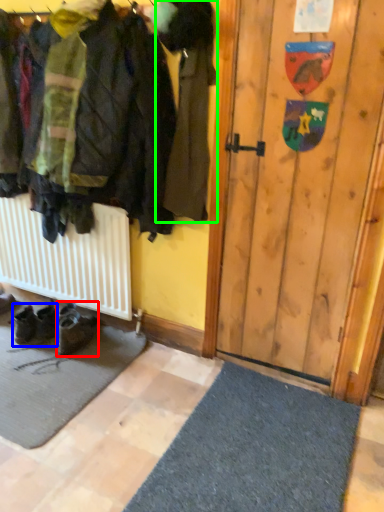
Question: Based on their relative distances, which object is nearer to footwear (highlighted by a red box)? Choose from footwear (highlighted by a blue box) and jacket (highlighted by a green box).

Choices:
 (A) footwear
 (B) jacket

Answer: (A)